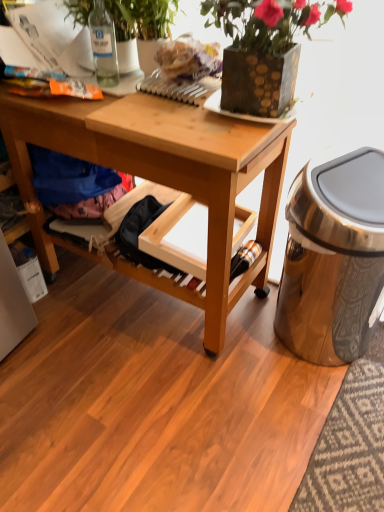
Find the location of `free space in front of wooden desk at center`. free space in front of wooden desk at center is located at coordinates pyautogui.click(x=167, y=420).